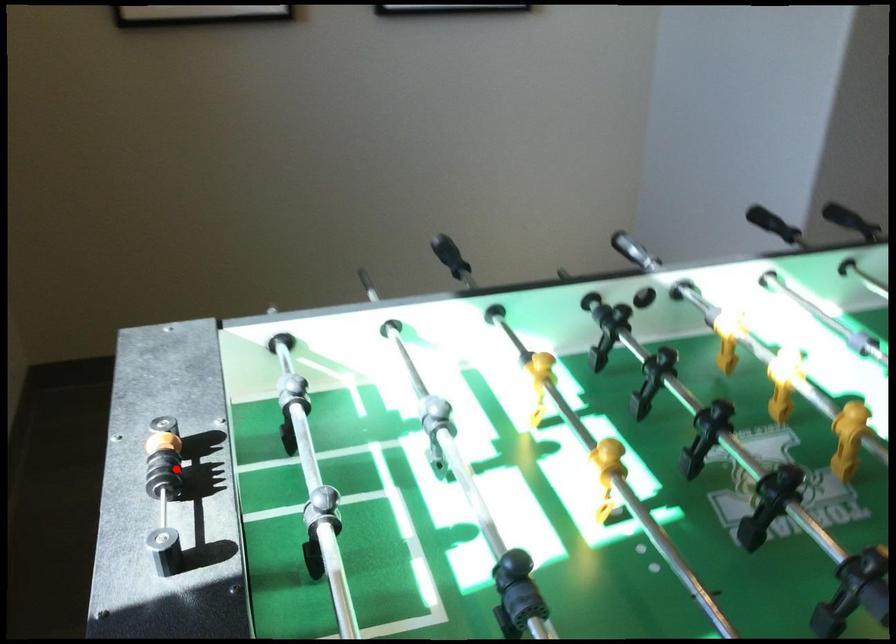
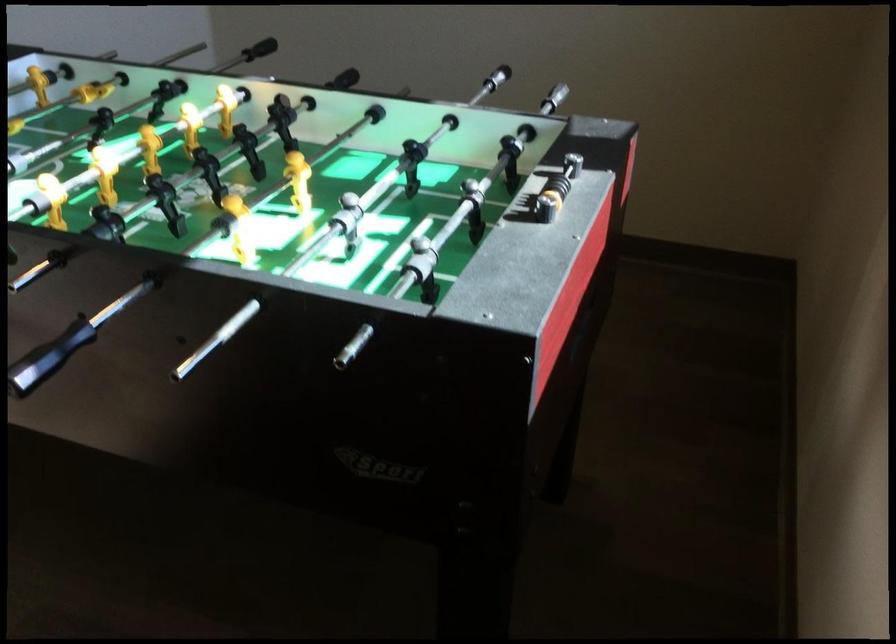
Where in the second image is the point corresponding to the highlighted location from the first image?

(556, 185)